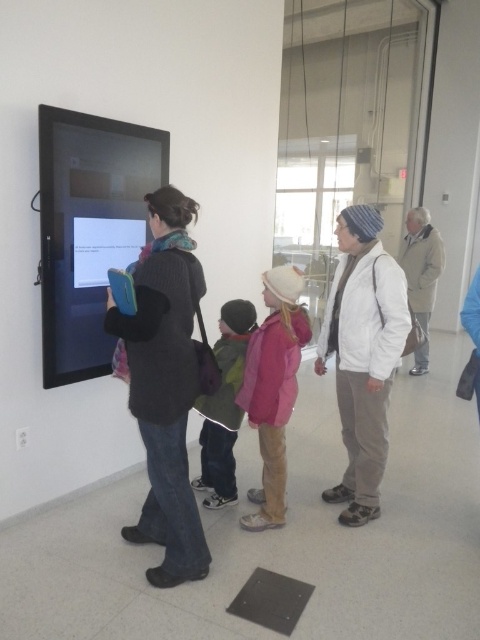
Between point (282, 493) and point (422, 321), which one is positioned in front?

Point (282, 493)

Does point (283, 410) come farther from viewer compared to point (439, 272)?

No, it is in front of (439, 272).

The height and width of the screenshot is (640, 480). What do you see at coordinates (274, 388) in the screenshot? I see `pink fleece jacket at center` at bounding box center [274, 388].

The height and width of the screenshot is (640, 480). I want to click on pink fleece jacket at center, so click(x=274, y=388).

In the scene shown: Measure the distance between point (157,442) and camera.

Point (157,442) is 7.27 feet away from camera.

Who is more forward, (175, 243) or (427, 301)?

Point (175, 243)

Identify the location of dark gray sweater at center. (165, 385).

Which is more to the right, white matte jacket at center or gray wool coat at right?

gray wool coat at right is more to the right.

Is white matte jacket at center to the right of gray wool coat at right from the viewer's perspective?

In fact, white matte jacket at center is to the left of gray wool coat at right.

Does point (380, 435) lie in front of point (422, 257)?

Yes.

The image size is (480, 640). Find the location of `white matte jacket at center`. white matte jacket at center is located at coordinates (362, 355).